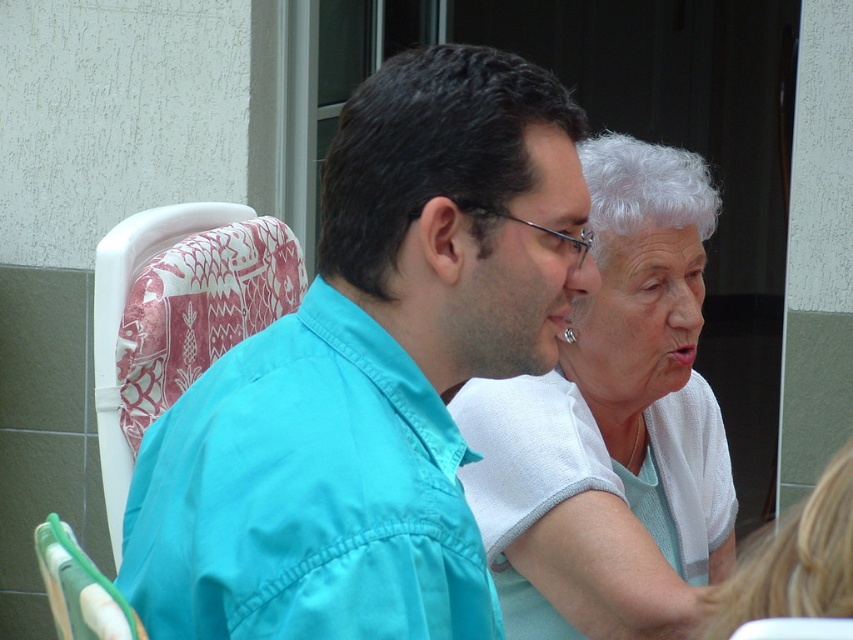
You are designing a new seating arrangement for a public space and need to ensure there is enough space between two people sitting next to each other. Given that the teal fabric shirt at center is wider than the white textured shirt at center, which person requires more space on their left side?

The teal fabric shirt at center requires more space on their left side because its width is larger than the white textured shirt at center.

You are designing a layout for a magazine cover featuring two people sitting side by side. The teal fabric shirt at center and the white textured shirt at center must be included. Given their sizes, which shirt should be placed closer to the center of the cover to maintain visual balance?

The teal fabric shirt at center occupies less space than the white textured shirt at center, so to maintain visual balance, the teal fabric shirt at center should be placed closer to the center of the cover since smaller elements are often positioned centrally to balance larger items.

You are an observer standing in front of the two people. You see the white textured shirt at center and the white fabric at upper right. Which object is located to the left of the other?

Answer: The white textured shirt at center is positioned on the left side of white fabric at upper right.